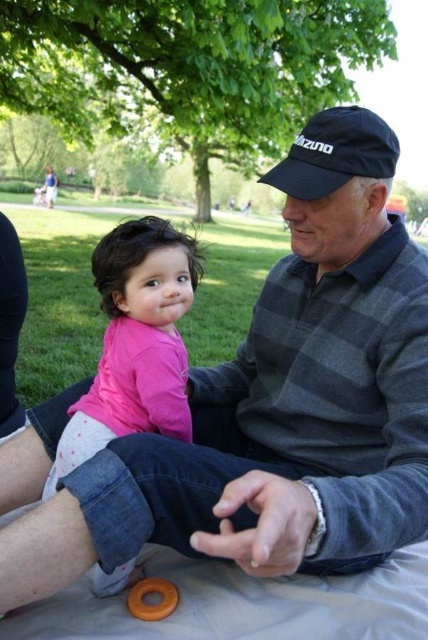
Question: Can you confirm if pink matte shirt at center is positioned to the left of black fabric baseball cap at upper center?

Choices:
 (A) yes
 (B) no

Answer: (A)

Question: Is pink matte shirt at center above black fabric baseball cap at upper center?

Choices:
 (A) yes
 (B) no

Answer: (B)

Question: Is pink matte shirt at center bigger than black fabric baseball cap at upper center?

Choices:
 (A) no
 (B) yes

Answer: (B)

Question: Among these points, which one is nearest to the camera?

Choices:
 (A) (122, 385)
 (B) (369, 122)

Answer: (B)

Question: Which point is closer to the camera?

Choices:
 (A) (363, 148)
 (B) (142, 289)

Answer: (A)

Question: Which object is closer to the camera taking this photo?

Choices:
 (A) black fabric baseball cap at upper center
 (B) pink matte shirt at center

Answer: (B)